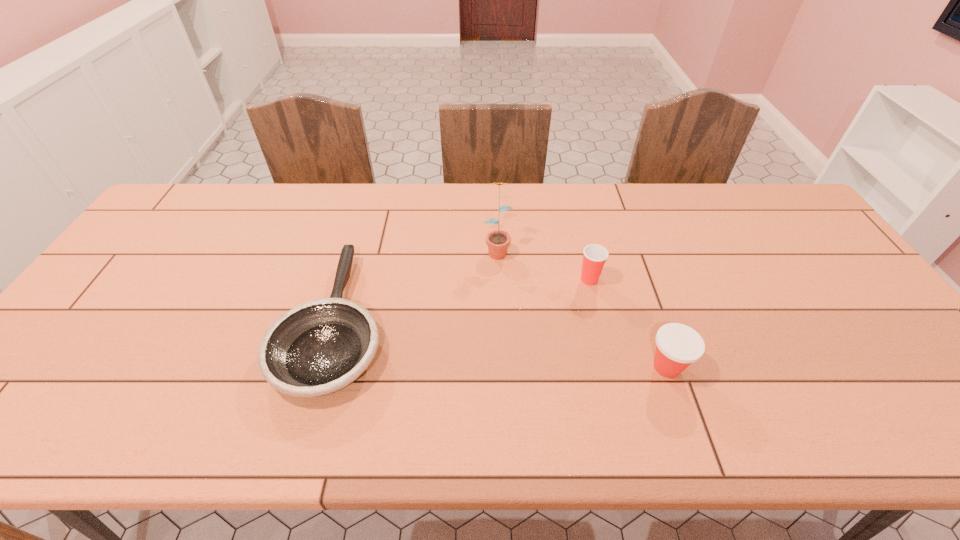
The width and height of the screenshot is (960, 540). Find the location of `the third object from right to left`. the third object from right to left is located at coordinates (497, 241).

Identify the location of sunflower. (497, 241).

This screenshot has width=960, height=540. In order to click on the third object from left to right in this screenshot , I will do point(594,256).

Identify the location of the farther Dixie cup. (594, 256).

I want to click on the right Dixie cup, so click(677, 346).

I want to click on the nearer Dixie cup, so click(677, 346).

The height and width of the screenshot is (540, 960). I want to click on the shortest object, so click(320, 347).

Locate an element on the screen. frying pan is located at coordinates (320, 347).

What are the coordinates of `vacant space located 0.380m on the flower of the sunflower` in the screenshot? It's located at (502, 376).

You are a GUI agent. You are given a task and a screenshot of the screen. Output one action in this format:
    pyautogui.click(x=<x>, y=<y>)
    Task: Click on the vacant area located on the back of the second object from right to left
    Image resolution: width=960 pixels, height=540 pixels.
    Given the screenshot: What is the action you would take?
    pyautogui.click(x=571, y=204)